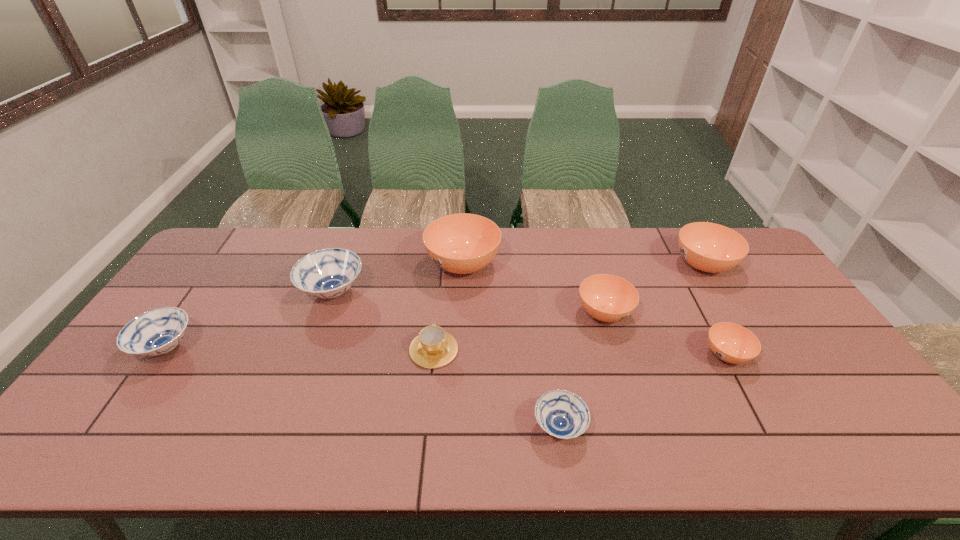
Where is `brown cup`? brown cup is located at coordinates (433, 348).

Find the location of a particular element. Image resolution: width=960 pixels, height=540 pixels. the fifth object from left to right is located at coordinates (560, 413).

Image resolution: width=960 pixels, height=540 pixels. I want to click on the fourth soup bowl from left to right, so click(560, 413).

Where is `free space located on the front of the tallest object`? This screenshot has height=540, width=960. free space located on the front of the tallest object is located at coordinates (459, 346).

Locate an element on the screen. The height and width of the screenshot is (540, 960). vacant space located 0.240m on the front of the second biggest peach soup bowl is located at coordinates tap(751, 343).

Find the location of a particular element. vacant area situated 0.130m on the right of the second blue soup bowl from left to right is located at coordinates (407, 292).

Image resolution: width=960 pixels, height=540 pixels. Find the location of `free region located on the right of the fifth soup bowl from left to right`. free region located on the right of the fifth soup bowl from left to right is located at coordinates [695, 313].

Find the location of a particular element. The image size is (960, 540). vacant space located on the back of the second smallest blue soup bowl is located at coordinates (234, 248).

The image size is (960, 540). I want to click on vacant space located 0.210m on the front of the nearest peach soup bowl, so click(777, 450).

Identify the location of vacant space located with the handle on the side of the cup. (444, 254).